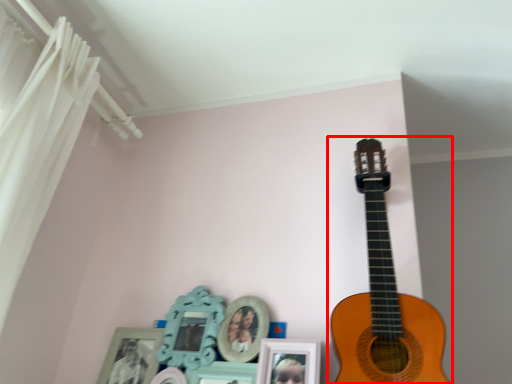
Question: Where is guitar (annotated by the red box) located in relation to curtain in the image?

Choices:
 (A) right
 (B) left

Answer: (A)